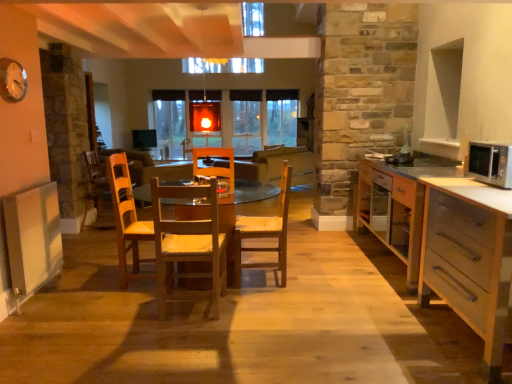
Image resolution: width=512 pixels, height=384 pixels. What are the coordinates of `silver metallic microwave at right` in the screenshot? It's located at (490, 163).

You are a GUI agent. You are given a task and a screenshot of the screen. Output one action in this format:
    pyautogui.click(x=<x>, y=<y>)
    Task: Click on the white wood drawer at lower right, the first cabinetry when ordered from front to back
    The width and height of the screenshot is (512, 384).
    Given the screenshot: What is the action you would take?
    pyautogui.click(x=468, y=262)

What do you see at coordinates (265, 232) in the screenshot? I see `wooden chair at center, acting as the 2th chair starting from the left` at bounding box center [265, 232].

What do you see at coordinates (397, 206) in the screenshot?
I see `light brown wood cabinet at right, which is the second cabinetry from front to back` at bounding box center [397, 206].

Identify the location of wooden table at center. (236, 215).

Is point (269, 163) less distant than point (197, 237)?

No, it is not.

Can you tell me how much wooden chair at center and wooden chair at center, the first chair viewed from the left, differ in facing direction?

The angular difference between wooden chair at center and wooden chair at center, the first chair viewed from the left, is 48.3 degrees.

From the image's perspective, is wooden chair at center located above wooden chair at center, positioned as the 2th chair in back-to-front order?

Yes, from the image's perspective, wooden chair at center is over wooden chair at center, positioned as the 2th chair in back-to-front order.

What's the angular difference between silver metallic microwave at right and wooden chair at center, arranged as the 2th chair when viewed from the right,'s facing directions?

The angular difference between silver metallic microwave at right and wooden chair at center, arranged as the 2th chair when viewed from the right, is 90.9 degrees.

Is silver metallic microwave at right not inside wooden chair at center, which is the first chair from front to back?

Yes, silver metallic microwave at right is located beyond the bounds of wooden chair at center, which is the first chair from front to back.

Is silver metallic microwave at right looking in the opposite direction of wooden chair at center, the first chair viewed from the left?

No.

From a real-world perspective, is silver metallic microwave at right under wooden chair at center, the first chair viewed from the left?

No.

Which is behind, wooden chair at center, positioned as the 2th chair in back-to-front order, or light brown wood cabinet at right, which appears as the first cabinetry when viewed from the back?

light brown wood cabinet at right, which appears as the first cabinetry when viewed from the back.

Is wooden chair at center, arranged as the 2th chair when viewed from the right, spatially inside light brown wood cabinet at right, which appears as the first cabinetry when viewed from the back, or outside of it?

wooden chair at center, arranged as the 2th chair when viewed from the right, is located beyond the bounds of light brown wood cabinet at right, which appears as the first cabinetry when viewed from the back.

Image resolution: width=512 pixels, height=384 pixels. I want to click on chair that is the 2nd one when counting downward from the light brown wood cabinet at right, which is the second cabinetry from front to back (from the image's perspective), so click(188, 246).

Considering the relative sizes of wooden chair at center and wooden chair at center, positioned as the first chair in right-to-left order, in the image provided, is wooden chair at center smaller than wooden chair at center, positioned as the first chair in right-to-left order,?

No.

Starting from the wooden chair at center, which chair is the 1st one to the left? Please provide its 2D coordinates.

[(265, 232)]

Is wooden chair at center, marked as the 2th chair in a front-to-back arrangement, inside wooden chair at center?

No, wooden chair at center, marked as the 2th chair in a front-to-back arrangement, is not a part of wooden chair at center.

Between wooden chair at center and wooden chair at center, acting as the 2th chair starting from the left, which one has less height?

wooden chair at center is shorter.

From the image's perspective, starting from the wooden armchair at left, which chair is the 2nd one below? Please provide its 2D coordinates.

[(188, 246)]

Are wooden armchair at left and wooden chair at center, which is the first chair from front to back, making contact?

No, wooden armchair at left is not making contact with wooden chair at center, which is the first chair from front to back.

From a real-world perspective, between wooden armchair at left and wooden chair at center, arranged as the 2th chair when viewed from the right, who is vertically higher?

wooden chair at center, arranged as the 2th chair when viewed from the right, from a real-world perspective.

Can you confirm if wooden armchair at left is thinner than wooden chair at center, which is the first chair from front to back?

No.

Does point (15, 78) appear closer or farther from the camera than point (510, 151)?

Point (15, 78).

Is white glossy clock at upper left facing away from silver metallic microwave at right?

No.

From the image's perspective, does white glossy clock at upper left appear higher than silver metallic microwave at right?

Yes, from the image's perspective, white glossy clock at upper left is on top of silver metallic microwave at right.

Consider the image. Does wooden table at center have a greater height compared to silver metallic microwave at right?

Indeed, wooden table at center has a greater height compared to silver metallic microwave at right.

Who is more distant, wooden table at center or silver metallic microwave at right?

wooden table at center is behind.

From a real-world perspective, is wooden table at center positioned over silver metallic microwave at right based on gravity?

Incorrect, from a real-world perspective, wooden table at center is lower than silver metallic microwave at right.

Is wooden table at center looking in the opposite direction of silver metallic microwave at right?

No, silver metallic microwave at right is not at the back of wooden table at center.

At what (x,y) coordinates should I click in order to perform the action: click on sit above the wooden chair at center, the first chair viewed from the left (from the image's perspective). Please return your answer as a coordinate pair (x, y). The image size is (512, 384). Looking at the image, I should click on (277, 166).

I want to click on the 2nd chair to the left of the silver metallic microwave at right, starting your count from the anchor, so click(x=188, y=246).

In the scene shown: Estimate the real-world distances between objects in this image. Which object is closer to wooden chair at center, white glossy clock at upper left or wooden chair at center, positioned as the first chair in right-to-left order?

wooden chair at center, positioned as the first chair in right-to-left order, is closer to wooden chair at center.

Consider the image. Based on their spatial positions, is wooden table at center or light brown wood cabinet at right, which appears as the first cabinetry when viewed from the back, closer to wooden armchair at left?

wooden table at center lies closer to wooden armchair at left than the other object.

Which object lies nearer to the anchor point silver metallic microwave at right, wooden chair at center, marked as the 2th chair in a front-to-back arrangement, or wooden table at center?

wooden chair at center, marked as the 2th chair in a front-to-back arrangement, lies closer to silver metallic microwave at right than the other object.

Based on their spatial positions, is wooden chair at center, which appears as the 1th chair when viewed from the back, or light brown wood cabinet at right, which is the second cabinetry from front to back, closer to white glossy clock at upper left?

The object closer to white glossy clock at upper left is wooden chair at center, which appears as the 1th chair when viewed from the back.

Which object lies further to the anchor point white wood drawer at lower right, the first cabinetry when ordered from front to back, wooden chair at center, which is the first chair from front to back, or wooden chair at center, positioned as the first chair in right-to-left order?

wooden chair at center, which is the first chair from front to back.

Considering their positions, is wooden armchair at left positioned further to wooden table at center than silver metallic microwave at right?

Based on the image, silver metallic microwave at right appears to be further to wooden table at center.

From the image, which object appears to be nearer to silver metallic microwave at right, wooden chair at center, which is the first chair from front to back, or white glossy clock at upper left?

wooden chair at center, which is the first chair from front to back, is positioned closer to the anchor silver metallic microwave at right.

Based on their spatial positions, is wooden chair at center, arranged as the 2th chair when viewed from the right, or wooden table at center further from silver metallic microwave at right?

Based on the image, wooden table at center appears to be further to silver metallic microwave at right.

Where is `microwave oven between white wood drawer at lower right, marked as the 2th cabinetry in a back-to-front arrangement, and wooden chair at center in the front-back direction`? The image size is (512, 384). microwave oven between white wood drawer at lower right, marked as the 2th cabinetry in a back-to-front arrangement, and wooden chair at center in the front-back direction is located at coordinates (490, 163).

Where is `chair located between wooden chair at center, which is the first chair from front to back, and wooden armchair at left in the depth direction`? chair located between wooden chair at center, which is the first chair from front to back, and wooden armchair at left in the depth direction is located at coordinates [x=265, y=232].

Find the location of a particular element. The height and width of the screenshot is (384, 512). table between wooden chair at center, arranged as the 2th chair when viewed from the right, and silver metallic microwave at right is located at coordinates (236, 215).

Image resolution: width=512 pixels, height=384 pixels. In order to click on table situated between white glossy clock at upper left and light brown wood cabinet at right, which is the second cabinetry from front to back, from left to right in this screenshot , I will do tap(236, 215).